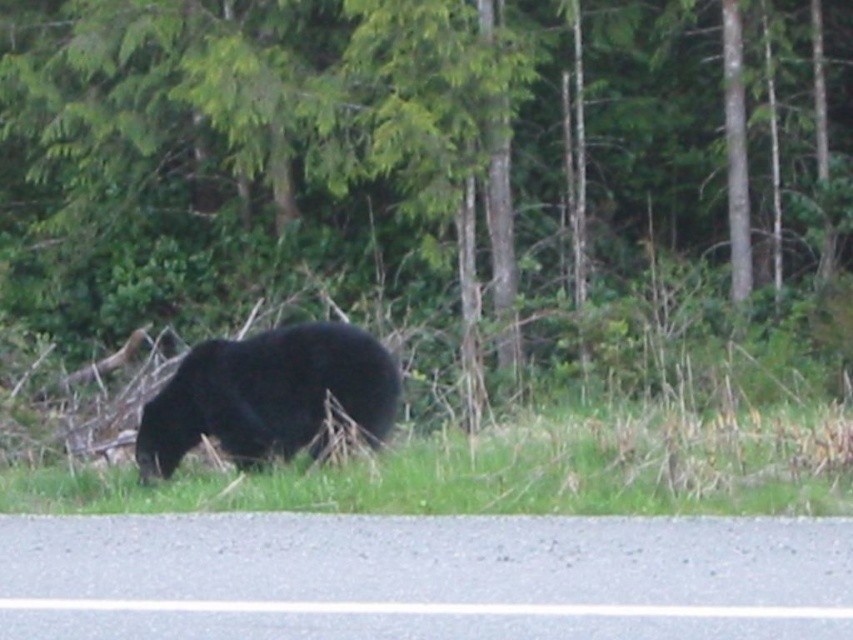
Question: Which of the following is the closest to the observer?

Choices:
 (A) (259, 376)
 (B) (225, 470)
 (C) (122, 10)

Answer: (A)

Question: Does green leafy tree at center lie in front of green grass at lower center?

Choices:
 (A) yes
 (B) no

Answer: (B)

Question: Does green leafy tree at center appear under green grass at lower center?

Choices:
 (A) no
 (B) yes

Answer: (A)

Question: Is green leafy tree at center thinner than black furry bear at center?

Choices:
 (A) yes
 (B) no

Answer: (B)

Question: Among these points, which one is farthest from the camera?

Choices:
 (A) pos(463,492)
 (B) pos(151,472)
 (C) pos(598,276)

Answer: (C)

Question: Which object is closer to the camera taking this photo?

Choices:
 (A) green leafy tree at center
 (B) green grass at lower center

Answer: (B)